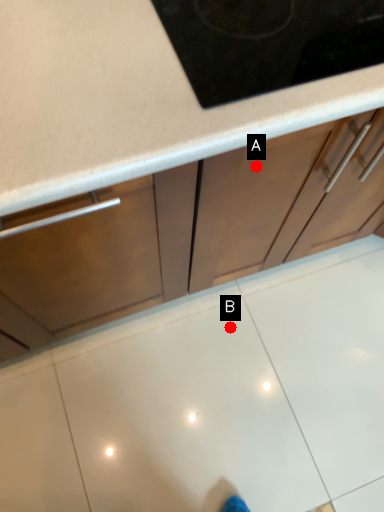
Question: Two points are circled on the image, labeled by A and B beside each circle. Among these points, which one is farthest from the camera?

Choices:
 (A) A is further
 (B) B is further

Answer: (B)